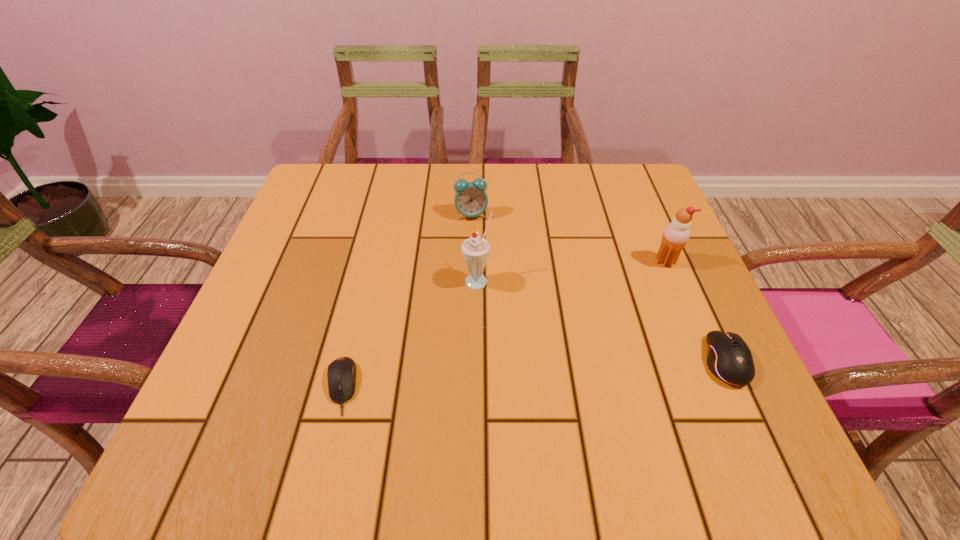
Where is `vacant area at the near right corner`? vacant area at the near right corner is located at coordinates (695, 405).

At what (x,y) coordinates should I click in order to perform the action: click on vacant space that's between the icecream and the milkshake. Please return your answer as a coordinate pair (x, y). This screenshot has height=540, width=960. Looking at the image, I should click on (571, 271).

I want to click on blank region between the alarm clock and the icecream, so click(568, 238).

Image resolution: width=960 pixels, height=540 pixels. Identify the location of vacant region between the right computer mouse and the third tallest object. click(599, 288).

At what (x,y) coordinates should I click in order to perform the action: click on unoccupied position between the shorter computer mouse and the right computer mouse. Please return your answer as a coordinate pair (x, y). Looking at the image, I should click on (534, 374).

Identify the location of free area in between the icecream and the left computer mouse. (503, 324).

Where is `free space between the icecream and the leftmost object`? free space between the icecream and the leftmost object is located at coordinates (503, 324).

The image size is (960, 540). In order to click on empty location between the right computer mouse and the milkshake in this screenshot , I will do `click(602, 321)`.

This screenshot has height=540, width=960. Find the location of `blank region between the second shortest object and the farthest object`. blank region between the second shortest object and the farthest object is located at coordinates point(599,288).

Find the location of a particular element. free space that is in between the icecream and the shortest object is located at coordinates (503, 324).